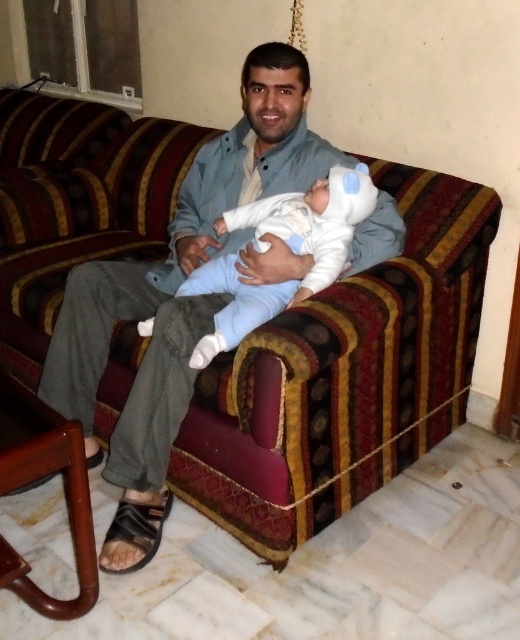
You are a photographer setting up a shoot in this room. You need to position a backdrop that is 1.2 meters wide. The backdrop must be placed behind the light blue denim shirt at center and the white soft baby at center. Can the backdrop accommodate both objects without overlapping them?

The light blue denim shirt at center might be wider than white soft baby at center, but since the backdrop is 1.2 meters wide, it can accommodate both objects as long as their combined width does not exceed the backdrop width. However, without exact measurements, we cannot confirm for certain.

A parent is holding their baby and wants to ensure they are close enough for comfort. Given that the recommended safe distance between a parent and a newborn is under 6 inches, is the light blue denim shirt at center close enough to the white soft baby at center?

The distance between the light blue denim shirt at center and the white soft baby at center is 5.43 inches, which is under the recommended 6 inches. Therefore, the light blue denim shirt at center is close enough for comfort.